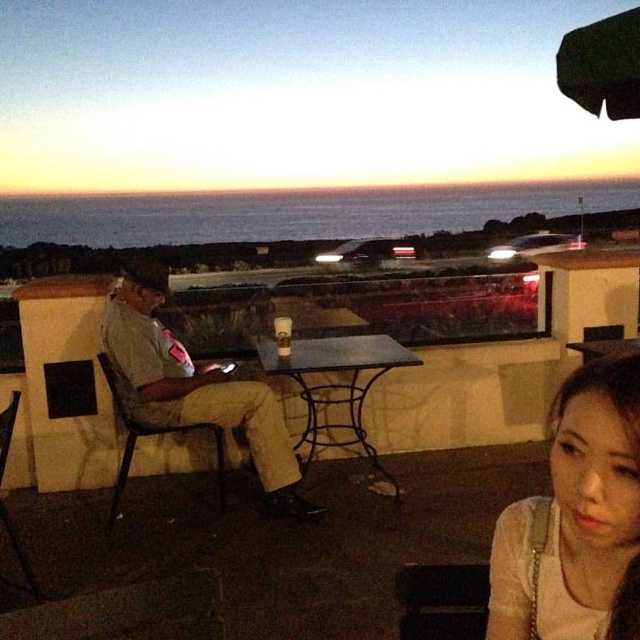
Can you confirm if smooth white blouse at lower right is smaller than matte gray shirt at left?

Yes, smooth white blouse at lower right is smaller than matte gray shirt at left.

Between smooth white blouse at lower right and matte gray shirt at left, which one has less height?

Standing shorter between the two is smooth white blouse at lower right.

This screenshot has height=640, width=640. In order to click on smooth white blouse at lower right in this screenshot , I will do `click(593, 506)`.

At what (x,y) coordinates should I click in order to perform the action: click on smooth white blouse at lower right. Please return your answer as a coordinate pair (x, y). Looking at the image, I should click on (593, 506).

Is smooth white blouse at lower right closer to camera compared to metallic black table at center?

That is True.

Is smooth white blouse at lower right above metallic black table at center?

Indeed, smooth white blouse at lower right is positioned over metallic black table at center.

Does point (497, 618) come farther from viewer compared to point (333, 445)?

No, it is in front of (333, 445).

Locate an element on the screen. Image resolution: width=640 pixels, height=640 pixels. smooth white blouse at lower right is located at coordinates (593, 506).

Which is behind, point (289, 497) or point (332, 356)?

Point (332, 356)

Is matte gray shirt at left bigger than metallic black table at center?

Indeed, matte gray shirt at left has a larger size compared to metallic black table at center.

Is point (268, 400) closer to viewer compared to point (381, 465)?

Yes, point (268, 400) is closer to viewer.

Find the location of a particular element. The image size is (640, 640). matte gray shirt at left is located at coordinates [193, 385].